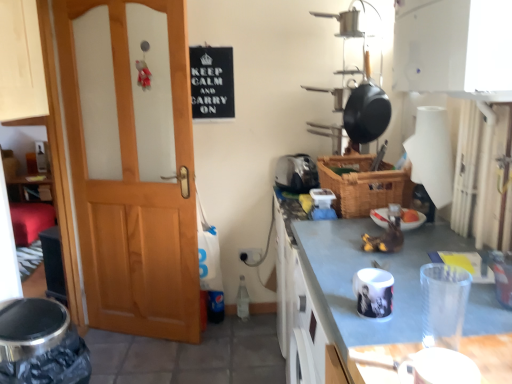
Where is `vacant area that is in front of wooden door at left`? Image resolution: width=512 pixels, height=384 pixels. vacant area that is in front of wooden door at left is located at coordinates (134, 363).